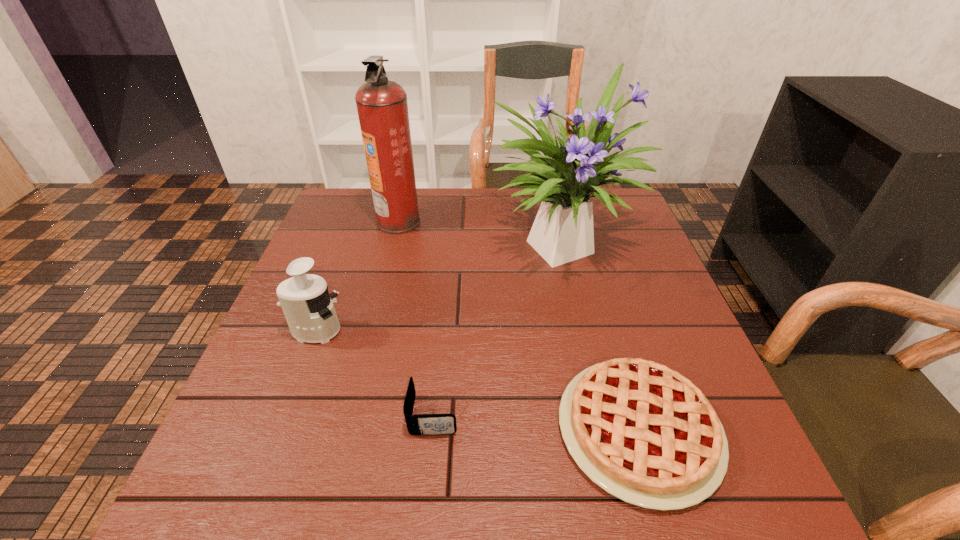
You are a GUI agent. You are given a task and a screenshot of the screen. Output one action in this format:
    pyautogui.click(x=<x>, y=<y>)
    Task: Click on the free space located on the back of the shortest object
    The image size is (960, 540).
    Given the screenshot: What is the action you would take?
    pyautogui.click(x=601, y=300)

This screenshot has width=960, height=540. I want to click on fire extinguisher that is at the far edge, so click(382, 107).

Locate an element on the screen. This screenshot has width=960, height=540. flower arrangement that is at the far edge is located at coordinates tap(562, 232).

The width and height of the screenshot is (960, 540). Identify the location of object situated at the near edge. (644, 433).

Where is `fire extinguisher located in the left edge section of the desktop`? fire extinguisher located in the left edge section of the desktop is located at coordinates (382, 107).

Locate an element on the screen. The height and width of the screenshot is (540, 960). juicer that is positioned at the left edge is located at coordinates (306, 303).

The image size is (960, 540). I want to click on flower arrangement at the right edge, so click(x=562, y=232).

Identify the location of pie present at the right edge. The image size is (960, 540). (644, 433).

Locate an element on the screen. The height and width of the screenshot is (540, 960). object present at the far left corner is located at coordinates (382, 107).

Locate an element on the screen. object at the far right corner is located at coordinates (562, 232).